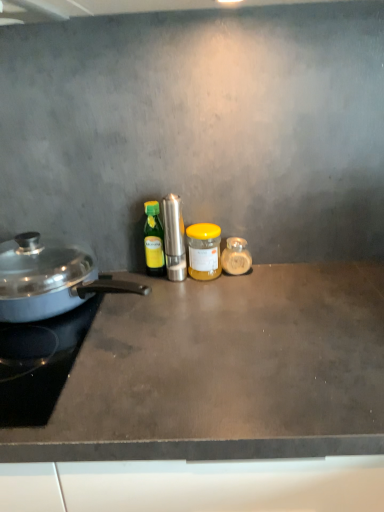
Identify the location of free region under shiny silver pan at left, acting as the fifth kitchen appliance starting from the right (from a real-world perspective). (80, 307).